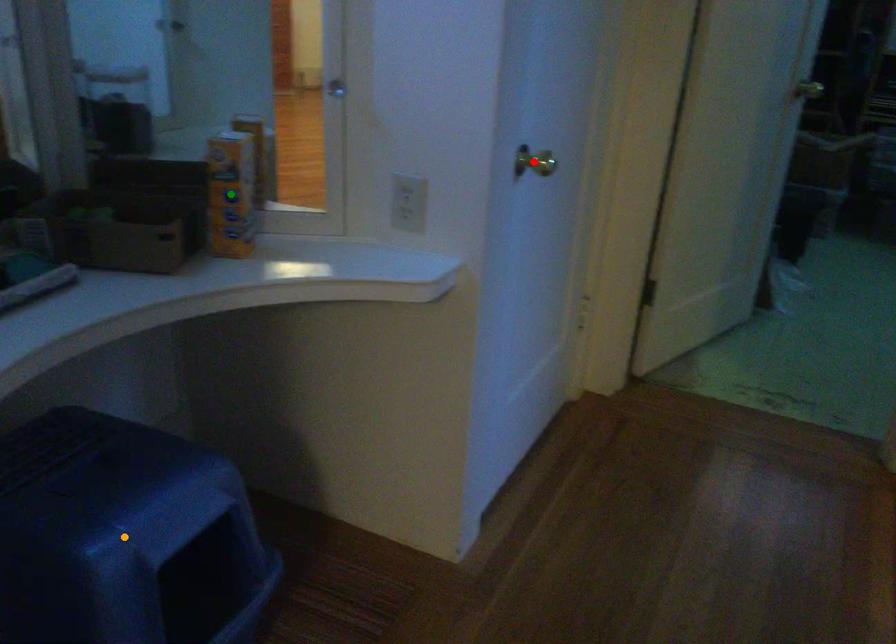
Order these from nearest to farthest:
A) red point
B) orange point
C) green point

orange point < green point < red point